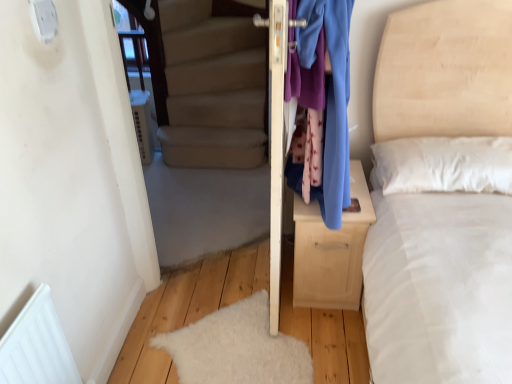
Question: From a real-world perspective, is light wood/texture nightstand at center below blue fabric at right?

Choices:
 (A) yes
 (B) no

Answer: (A)

Question: From a real-world perspective, is light wood/texture nightstand at center located higher than blue fabric at right?

Choices:
 (A) no
 (B) yes

Answer: (A)

Question: Is light wood/texture nightstand at center bigger than blue fabric at right?

Choices:
 (A) yes
 (B) no

Answer: (B)

Question: Is light wood/texture nightstand at center smaller than blue fabric at right?

Choices:
 (A) yes
 (B) no

Answer: (A)

Question: Is light wood/texture nightstand at center thinner than blue fabric at right?

Choices:
 (A) no
 (B) yes

Answer: (A)

Question: Does light wood/texture nightstand at center have a lesser height compared to blue fabric at right?

Choices:
 (A) no
 (B) yes

Answer: (B)

Question: Can you confirm if light wood/texture nightstand at center is positioned to the right of white fluffy mat at lower left?

Choices:
 (A) no
 (B) yes

Answer: (B)

Question: Does light wood/texture nightstand at center have a smaller size compared to white fluffy mat at lower left?

Choices:
 (A) yes
 (B) no

Answer: (B)

Question: Does light wood/texture nightstand at center have a greater width compared to white fluffy mat at lower left?

Choices:
 (A) no
 (B) yes

Answer: (A)

Question: From the image's perspective, is light wood/texture nightstand at center located beneath white fluffy mat at lower left?

Choices:
 (A) yes
 (B) no

Answer: (B)

Question: From a real-world perspective, is light wood/texture nightstand at center positioned under white fluffy mat at lower left based on gravity?

Choices:
 (A) yes
 (B) no

Answer: (B)

Question: Is white fluffy mat at lower left a part of light wood/texture nightstand at center?

Choices:
 (A) yes
 (B) no

Answer: (B)

Question: Can you confirm if blue fabric at right is positioned to the right of light wood/texture nightstand at center?

Choices:
 (A) yes
 (B) no

Answer: (B)